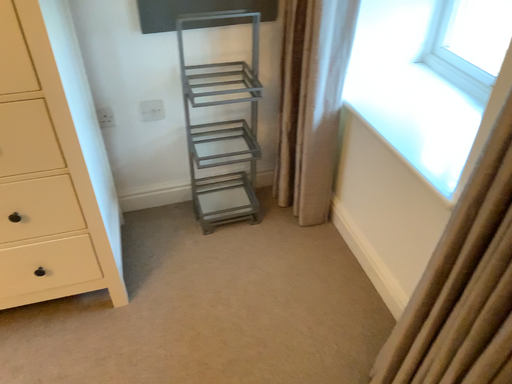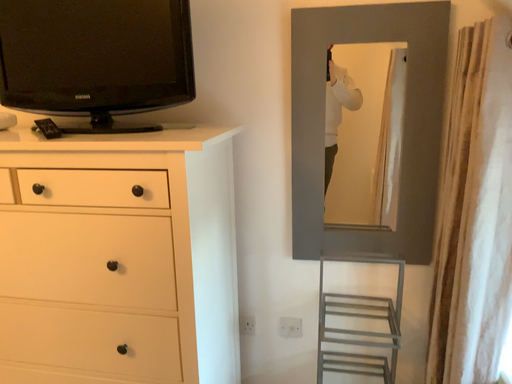
Question: Which way did the camera rotate in the video?

Choices:
 (A) rotated downward
 (B) rotated upward

Answer: (B)